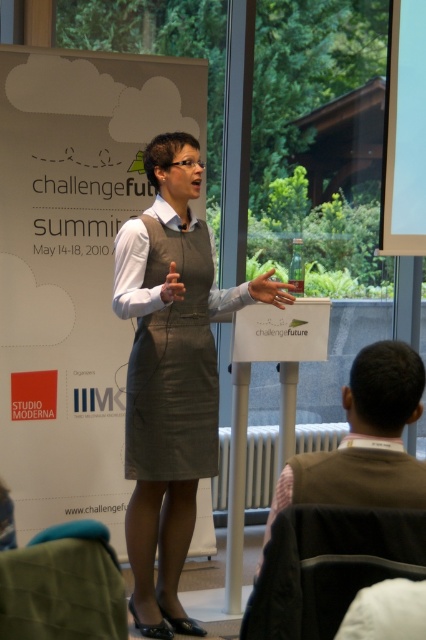
Question: Which of the following is the farthest from the observer?

Choices:
 (A) (160, 332)
 (B) (402, 486)
 (C) (195, 230)

Answer: (C)

Question: Which point is farther to the camera?

Choices:
 (A) (391, 483)
 (B) (158, 323)
 (C) (201, 413)

Answer: (C)

Question: Which object appears closest to the camera in this image?

Choices:
 (A) gray leather dress at center
 (B) brown fabric vest at lower right
 (C) matte gray dress at center

Answer: (B)

Question: From the image, what is the correct spatial relationship of matte gray dress at center in relation to gray leather dress at center?

Choices:
 (A) above
 (B) below

Answer: (B)

Question: Is gray leather dress at center below brown fabric vest at lower right?

Choices:
 (A) yes
 (B) no

Answer: (B)

Question: Is gray leather dress at center bigger than brown fabric vest at lower right?

Choices:
 (A) yes
 (B) no

Answer: (A)